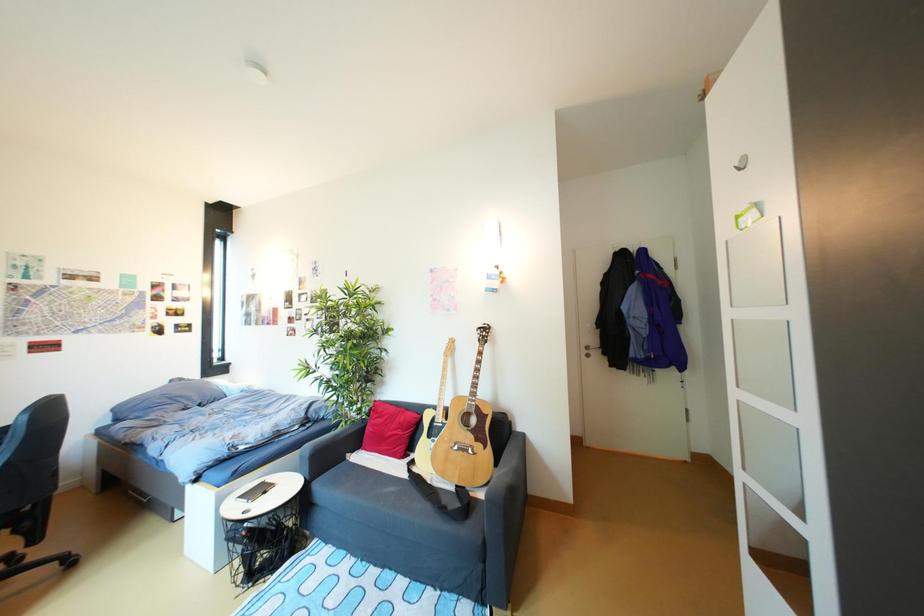
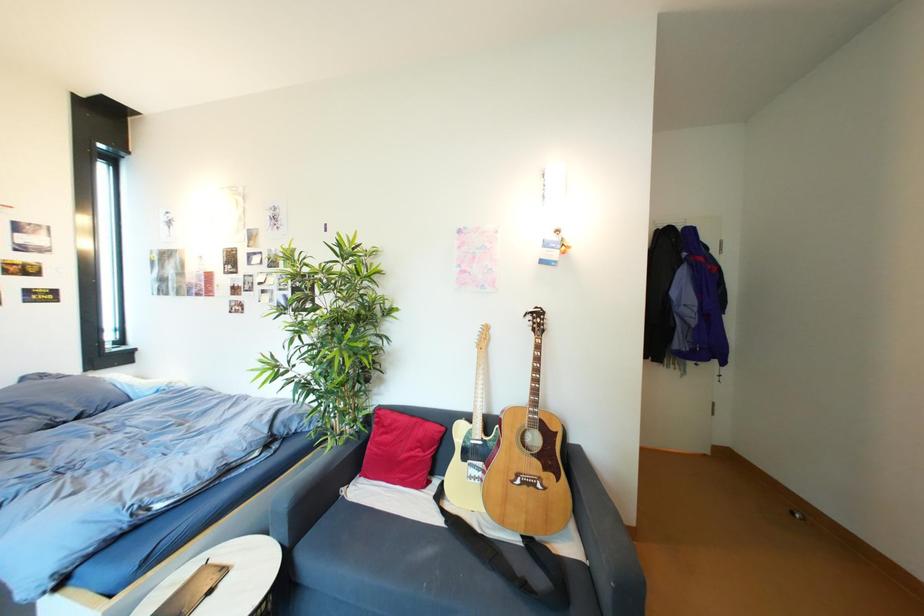
In the scene shown: What movement of the cameraman would produce the second image?

The cameraman moved toward left, forward.